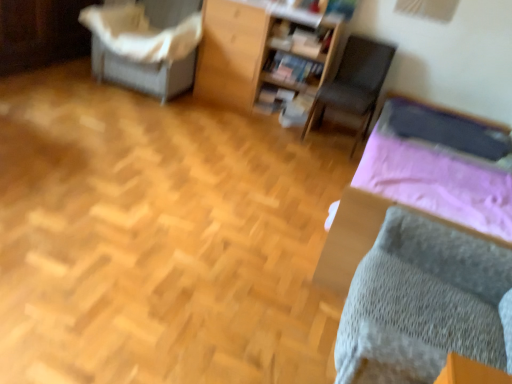
Measure the distance between dark gray fabric chair at center and camera.

They are 3.23 meters apart.

The height and width of the screenshot is (384, 512). Describe the element at coordinates (293, 68) in the screenshot. I see `matte wooden bookshelf at center` at that location.

Measure the distance between point (x=251, y=10) and camera.

They are 3.31 meters apart.

This screenshot has height=384, width=512. What do you see at coordinates (421, 180) in the screenshot?
I see `gray knitted bed at lower right` at bounding box center [421, 180].

Where is `dark gray fabric chair at center`? The image size is (512, 384). dark gray fabric chair at center is located at coordinates (354, 84).

Which is more to the right, white fabric-covered chair at upper left, which is counted as the first furniture, starting from the left, or dark gray fabric chair at center?

dark gray fabric chair at center.

Measure the distance from white fabric-covered chair at upper left, which is counted as the first furniture, starting from the left, to dark gray fabric chair at center.

The distance of white fabric-covered chair at upper left, which is counted as the first furniture, starting from the left, from dark gray fabric chair at center is 4.57 feet.

Does point (135, 77) come closer to viewer compared to point (388, 62)?

No, (135, 77) is further to viewer.

Are white fabric-covered chair at upper left, the 2th furniture in the right-to-left sequence, and dark gray fabric chair at center far apart?

Absolutely, white fabric-covered chair at upper left, the 2th furniture in the right-to-left sequence, is distant from dark gray fabric chair at center.

From the image's perspective, which one is positioned lower, matte wooden bookshelf at center or gray knitted bed at lower right?

gray knitted bed at lower right is shown below in the image.

Is matte wooden bookshelf at center touching gray knitted bed at lower right?

No, matte wooden bookshelf at center is not beside gray knitted bed at lower right.

Is matte wooden bookshelf at center oriented away from gray knitted bed at lower right?

No, matte wooden bookshelf at center's orientation is not away from gray knitted bed at lower right.

Considering the relative positions of matte wooden bookshelf at center and gray knitted bed at lower right in the image provided, is matte wooden bookshelf at center to the left or to the right of gray knitted bed at lower right?

Clearly, matte wooden bookshelf at center is on the left of gray knitted bed at lower right in the image.

Is point (285, 74) positioned in front of point (225, 4)?

That is False.

From the image's perspective, is matte wooden bookshelf at center above or below wooden bookshelf at upper center, arranged as the second furniture when viewed from the left?

Based on their image positions, matte wooden bookshelf at center is located beneath wooden bookshelf at upper center, arranged as the second furniture when viewed from the left.

From a real-world perspective, between matte wooden bookshelf at center and wooden bookshelf at upper center, the 1th furniture from the right, who is vertically lower?

matte wooden bookshelf at center is physically lower.

Between matte wooden bookshelf at center and wooden bookshelf at upper center, arranged as the second furniture when viewed from the left, which one has smaller width?

With smaller width is matte wooden bookshelf at center.

From the picture: Who is shorter, matte wooden bookshelf at center or dark gray fabric chair at center?

matte wooden bookshelf at center is shorter.

Which is farther from the camera, (x=305, y=80) or (x=394, y=50)?

The point (x=305, y=80) is farther.

How many degrees apart are the facing directions of matte wooden bookshelf at center and dark gray fabric chair at center?

The facing directions of matte wooden bookshelf at center and dark gray fabric chair at center are 4.4 degrees apart.

Which object is positioned more to the right, matte wooden bookshelf at center or dark gray fabric chair at center?

dark gray fabric chair at center.

From the image's perspective, between wooden bookshelf at upper center, arranged as the second furniture when viewed from the left, and dark gray fabric chair at center, which one is located above?

wooden bookshelf at upper center, arranged as the second furniture when viewed from the left, is shown above in the image.

Does wooden bookshelf at upper center, the 1th furniture from the right, appear on the right side of dark gray fabric chair at center?

In fact, wooden bookshelf at upper center, the 1th furniture from the right, is to the left of dark gray fabric chair at center.

Considering the sizes of objects wooden bookshelf at upper center, the 1th furniture from the right, and dark gray fabric chair at center in the image provided, who is thinner, wooden bookshelf at upper center, the 1th furniture from the right, or dark gray fabric chair at center?

Thinner between the two is wooden bookshelf at upper center, the 1th furniture from the right.

Measure the distance between wooden bookshelf at upper center, arranged as the second furniture when viewed from the left, and dark gray fabric chair at center.

wooden bookshelf at upper center, arranged as the second furniture when viewed from the left, and dark gray fabric chair at center are 51.81 centimeters apart.

Which of these two, dark gray fabric chair at center or white fabric-covered chair at upper left, the 2th furniture in the right-to-left sequence, stands shorter?

dark gray fabric chair at center.

Is the depth of dark gray fabric chair at center greater than that of white fabric-covered chair at upper left, which is counted as the first furniture, starting from the left?

No, dark gray fabric chair at center is closer to the camera.

How many degrees apart are the facing directions of dark gray fabric chair at center and white fabric-covered chair at upper left, the 2th furniture in the right-to-left sequence?

There is a 3.74-degree angle between the facing directions of dark gray fabric chair at center and white fabric-covered chair at upper left, the 2th furniture in the right-to-left sequence.

Is white fabric-covered chair at upper left, the 2th furniture in the right-to-left sequence, inside dark gray fabric chair at center?

No, white fabric-covered chair at upper left, the 2th furniture in the right-to-left sequence, is not inside dark gray fabric chair at center.

Considering the points (191, 31) and (286, 74), which point is in front, point (191, 31) or point (286, 74)?

The point (191, 31) is closer.

Is white fabric-covered chair at upper left, which is counted as the first furniture, starting from the left, bigger than matte wooden bookshelf at center?

Yes.

Looking at this image, from the image's perspective, is white fabric-covered chair at upper left, the 2th furniture in the right-to-left sequence, located above matte wooden bookshelf at center?

Yes, from the image's perspective, white fabric-covered chair at upper left, the 2th furniture in the right-to-left sequence, is above matte wooden bookshelf at center.

Based on the photo, are white fabric-covered chair at upper left, which is counted as the first furniture, starting from the left, and matte wooden bookshelf at center far apart?

That's not correct — white fabric-covered chair at upper left, which is counted as the first furniture, starting from the left, is a little close to matte wooden bookshelf at center.

Locate an element on the screen. Image resolution: width=512 pixels, height=384 pixels. furniture that is the 2nd object to the left of the dark gray fabric chair at center, starting at the anchor is located at coordinates [145, 44].

At what (x,y) coordinates should I click in order to perform the action: click on book above the gray knitted bed at lower right (from the image's perspective). Please return your answer as a coordinate pair (x, y). Looking at the image, I should click on (293, 68).

Looking at the image, which one is located further to gray knitted bed at lower right, dark gray fabric chair at center or matte wooden bookshelf at center?

matte wooden bookshelf at center is positioned further to the anchor gray knitted bed at lower right.

From the image, which object appears to be nearer to wooden bookshelf at upper center, arranged as the second furniture when viewed from the left, white fabric-covered chair at upper left, which is counted as the first furniture, starting from the left, or gray knitted bed at lower right?

white fabric-covered chair at upper left, which is counted as the first furniture, starting from the left, is closer to wooden bookshelf at upper center, arranged as the second furniture when viewed from the left.

Considering their positions, is matte wooden bookshelf at center positioned further to white fabric-covered chair at upper left, the 2th furniture in the right-to-left sequence, than dark gray fabric chair at center?

dark gray fabric chair at center lies further to white fabric-covered chair at upper left, the 2th furniture in the right-to-left sequence, than the other object.

In the scene shown: From the image, which object appears to be farther from gray knitted bed at lower right, dark gray fabric chair at center or white fabric-covered chair at upper left, which is counted as the first furniture, starting from the left?

white fabric-covered chair at upper left, which is counted as the first furniture, starting from the left, is positioned further to the anchor gray knitted bed at lower right.

Which object lies nearer to the anchor point matte wooden bookshelf at center, dark gray fabric chair at center or white fabric-covered chair at upper left, the 2th furniture in the right-to-left sequence?

dark gray fabric chair at center is closer to matte wooden bookshelf at center.

Based on their spatial positions, is wooden bookshelf at upper center, arranged as the second furniture when viewed from the left, or white fabric-covered chair at upper left, the 2th furniture in the right-to-left sequence, closer to dark gray fabric chair at center?

wooden bookshelf at upper center, arranged as the second furniture when viewed from the left, lies closer to dark gray fabric chair at center than the other object.

From the picture: Based on their spatial positions, is dark gray fabric chair at center or matte wooden bookshelf at center closer to white fabric-covered chair at upper left, which is counted as the first furniture, starting from the left?

matte wooden bookshelf at center lies closer to white fabric-covered chair at upper left, which is counted as the first furniture, starting from the left, than the other object.

When comparing their distances from white fabric-covered chair at upper left, the 2th furniture in the right-to-left sequence, does gray knitted bed at lower right or matte wooden bookshelf at center seem further?

Among the two, gray knitted bed at lower right is located further to white fabric-covered chair at upper left, the 2th furniture in the right-to-left sequence.

The image size is (512, 384). Find the location of `furniture situated between white fabric-covered chair at upper left, which is counted as the first furniture, starting from the left, and matte wooden bookshelf at center from left to right`. furniture situated between white fabric-covered chair at upper left, which is counted as the first furniture, starting from the left, and matte wooden bookshelf at center from left to right is located at coordinates (232, 54).

Where is `furniture situated between white fabric-covered chair at upper left, the 2th furniture in the right-to-left sequence, and dark gray fabric chair at center from left to right`? The width and height of the screenshot is (512, 384). furniture situated between white fabric-covered chair at upper left, the 2th furniture in the right-to-left sequence, and dark gray fabric chair at center from left to right is located at coordinates pyautogui.click(x=232, y=54).

At what (x,y) coordinates should I click in order to perform the action: click on book between wooden bookshelf at upper center, the 1th furniture from the right, and dark gray fabric chair at center. Please return your answer as a coordinate pair (x, y). Looking at the image, I should click on tap(293, 68).

Identify the location of book between white fabric-covered chair at upper left, the 2th furniture in the right-to-left sequence, and dark gray fabric chair at center, in the horizontal direction. This screenshot has height=384, width=512. (293, 68).